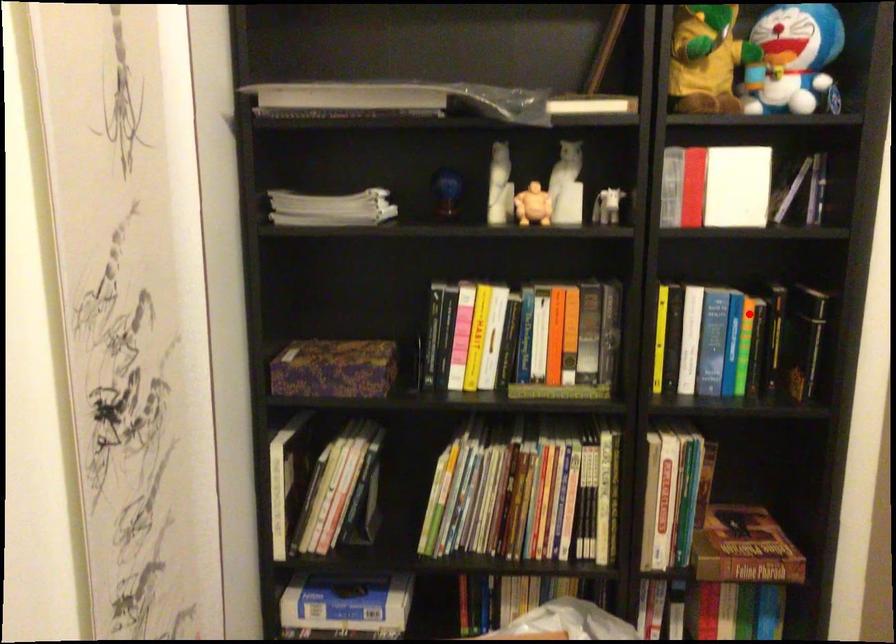
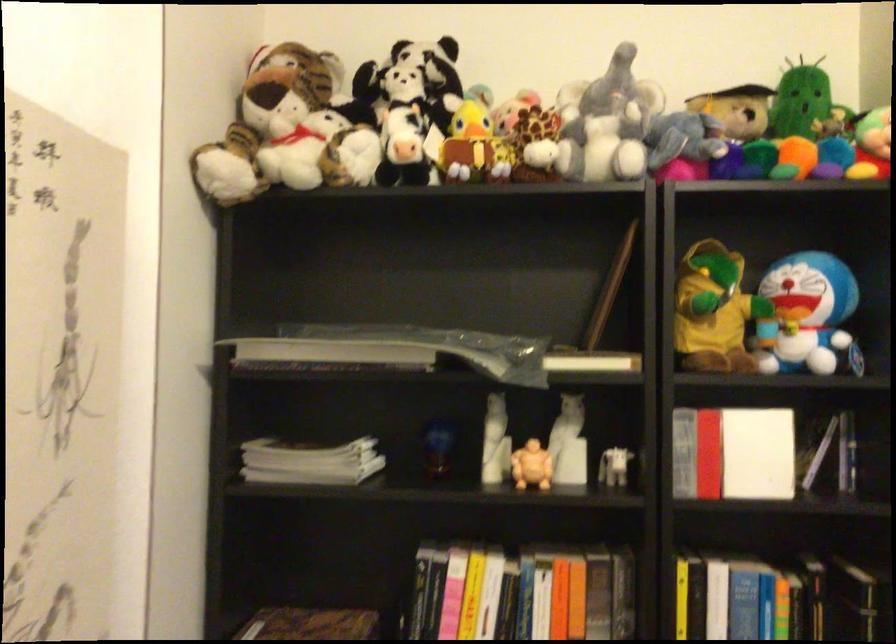
Question: I am providing you with two images of the same scene from different viewpoints. In image1, a red point is highlighted. Considering the same 3D point in image2, which of the following is correct?

Choices:
 (A) It is closer
 (B) It is farther

Answer: (A)